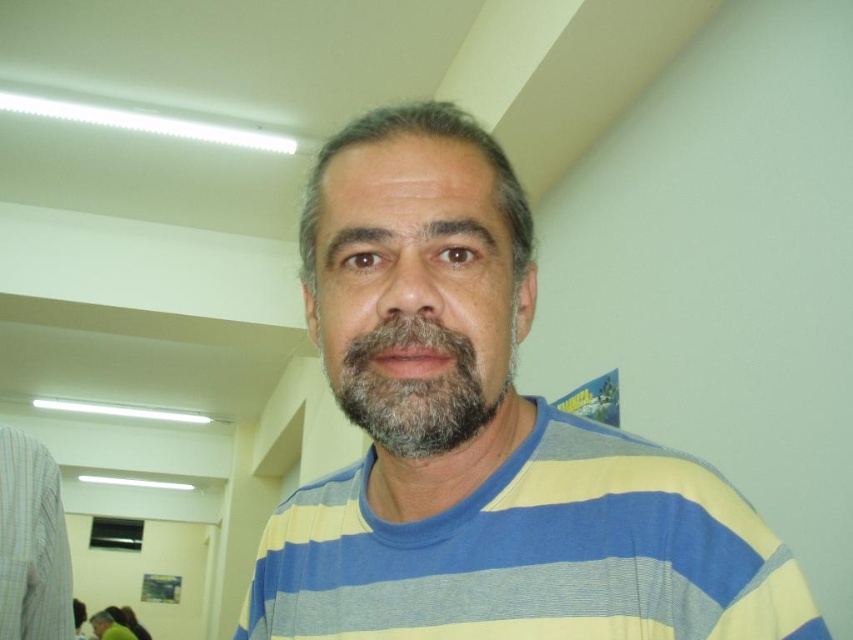
You are standing in an office or classroom and see a person wearing a horizontally striped shirt in the center. There is a point at coordinates [532,554]. Based on the image, where is this point located?

The point at coordinates [532,554] is located on the yellow and blue striped t shirt at center.